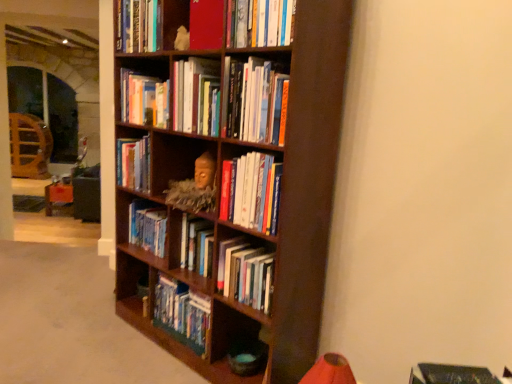
Question: Is hardcover book at upper center, acting as the third book starting from the top, a part of dark wood bookcase at center?

Choices:
 (A) no
 (B) yes

Answer: (B)

Question: Are dark wood bookcase at center and hardcover book at upper center, the eighth book when ordered from bottom to top, far apart?

Choices:
 (A) no
 (B) yes

Answer: (A)

Question: From a real-world perspective, is dark wood bookcase at center beneath hardcover book at upper center, the eighth book when ordered from bottom to top?

Choices:
 (A) no
 (B) yes

Answer: (B)

Question: Is dark wood bookcase at center closer to the viewer compared to hardcover book at upper center, acting as the third book starting from the top?

Choices:
 (A) no
 (B) yes

Answer: (B)

Question: From the image's perspective, is dark wood bookcase at center located above hardcover book at upper center, the eighth book when ordered from bottom to top?

Choices:
 (A) yes
 (B) no

Answer: (B)

Question: Does dark wood bookcase at center have a lesser width compared to hardcover book at upper center, acting as the third book starting from the top?

Choices:
 (A) no
 (B) yes

Answer: (A)

Question: From a real-world perspective, is hardcover books at center, the fourth book viewed from the top, on top of hardcover book at center, the 9th book in the top-to-bottom sequence?

Choices:
 (A) no
 (B) yes

Answer: (B)

Question: Considering the relative positions of hardcover books at center, the fourth book viewed from the top, and hardcover book at center, the 9th book in the top-to-bottom sequence, in the image provided, is hardcover books at center, the fourth book viewed from the top, to the left of hardcover book at center, the 9th book in the top-to-bottom sequence, from the viewer's perspective?

Choices:
 (A) yes
 (B) no

Answer: (A)

Question: Can you confirm if hardcover books at center, the 7th book ordered from the bottom, is bigger than hardcover book at center, the 2th book positioned from the bottom?

Choices:
 (A) no
 (B) yes

Answer: (B)

Question: Is hardcover books at center, the fourth book viewed from the top, in front of hardcover book at center, the 2th book positioned from the bottom?

Choices:
 (A) yes
 (B) no

Answer: (B)

Question: Considering the relative positions of hardcover books at center, the fourth book viewed from the top, and hardcover book at center, the 2th book positioned from the bottom, in the image provided, is hardcover books at center, the fourth book viewed from the top, to the right of hardcover book at center, the 2th book positioned from the bottom, from the viewer's perspective?

Choices:
 (A) yes
 (B) no

Answer: (B)

Question: Is hardcover books at center, the 7th book ordered from the bottom, looking in the opposite direction of hardcover book at center, the 2th book positioned from the bottom?

Choices:
 (A) yes
 (B) no

Answer: (B)

Question: Is dark wood bookcase at center oriented away from matte red book at upper center, which is counted as the 9th book, starting from the bottom?

Choices:
 (A) no
 (B) yes

Answer: (B)